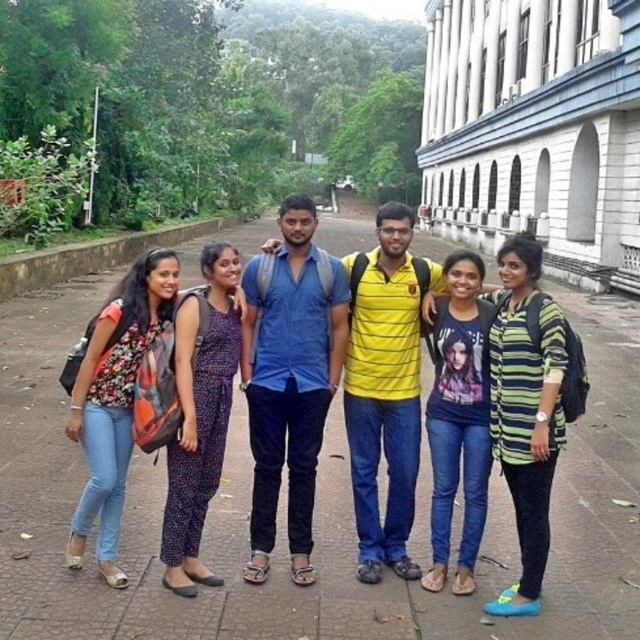
You are a photographer trying to adjust the composition of the group photo. You notice the blue denim shirt at center and the purple dotted jumpsuit at center. Which of these two items should you ask the person wearing it to stand slightly taller to ensure they are both at the same height level?

The blue denim shirt at center is taller than the purple dotted jumpsuit at center. Therefore, you should ask the person wearing the purple dotted jumpsuit at center to stand slightly taller to match the height of the blue denim shirt at center.